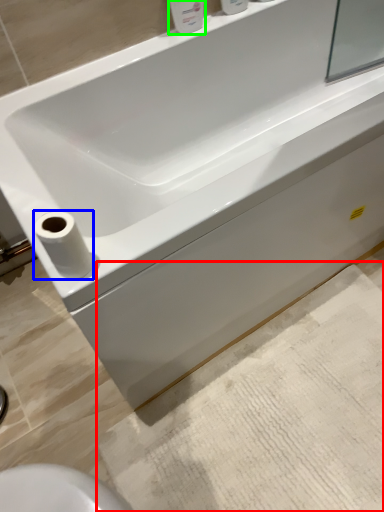
Question: Estimate the real-world distances between objects in this image. Which object is farther from bath mat (highlighted by a red box), toilet paper (highlighted by a blue box) or toiletry (highlighted by a green box)?

Choices:
 (A) toilet paper
 (B) toiletry

Answer: (B)